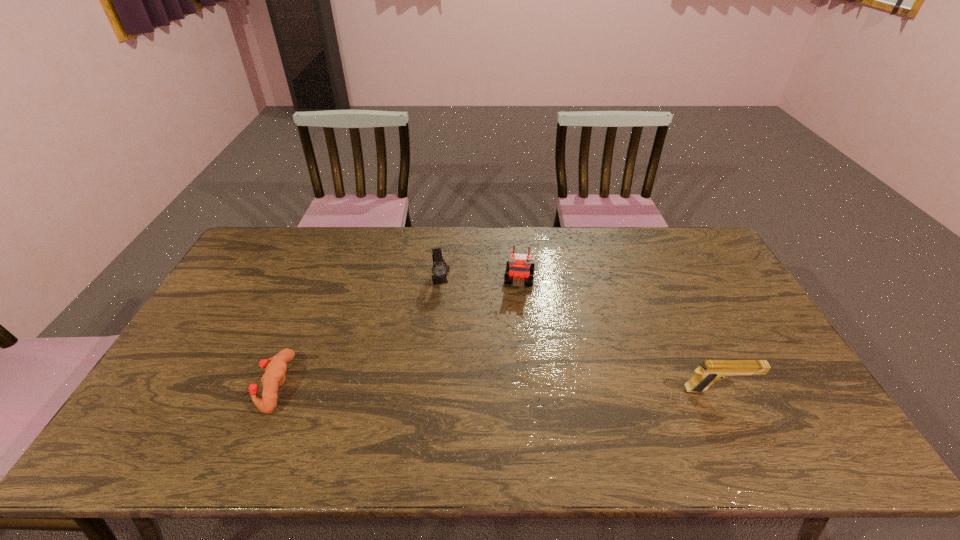
You are a GUI agent. You are given a task and a screenshot of the screen. Output one action in this format:
    pyautogui.click(x=<x>, y=<y>)
    Task: Click on the shortest object
    This screenshot has height=540, width=960.
    Given the screenshot: What is the action you would take?
    pyautogui.click(x=273, y=378)

Where is `puncher`? puncher is located at coordinates (273, 378).

You are a GUI agent. You are given a task and a screenshot of the screen. Output one action in this format:
    pyautogui.click(x=<x>, y=<y>)
    Task: Click on the rightmost object
    The width and height of the screenshot is (960, 540).
    Given the screenshot: What is the action you would take?
    pyautogui.click(x=710, y=371)

This screenshot has height=540, width=960. What are the coordinates of `Lego` in the screenshot? It's located at (519, 267).

This screenshot has height=540, width=960. I want to click on the second object from left to right, so click(x=440, y=269).

The height and width of the screenshot is (540, 960). What are the coordinates of `vacant space located 0.170m with the gloves of the shortest object facing forward` in the screenshot? It's located at (194, 384).

Locate an element on the screen. The image size is (960, 540). free spot located with the gloves of the shortest object facing forward is located at coordinates (225, 384).

Locate an element on the screen. The image size is (960, 540). vacant space located 0.190m with the gloves of the shortest object facing forward is located at coordinates (186, 384).

Locate an element on the screen. The image size is (960, 540). free space located at the barrel of the pistol is located at coordinates (800, 390).

Identify the location of vacant area situated 0.050m on the front-facing side of the Lego. (517, 302).